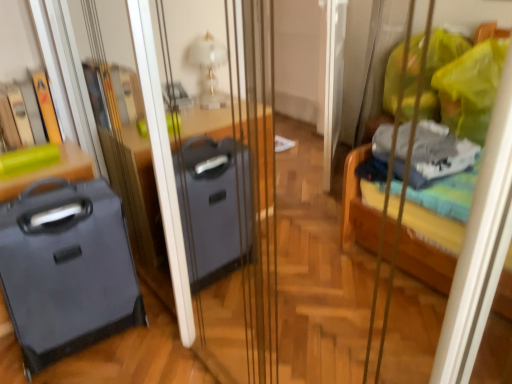
Question: Choose the correct answer: Is matte black suitcase at left inside green matte suitcase at left or outside it?

Choices:
 (A) inside
 (B) outside

Answer: (B)

Question: Considering the positions of point tap(120, 243) and point tap(12, 183), is point tap(120, 243) closer or farther from the camera than point tap(12, 183)?

Choices:
 (A) farther
 (B) closer

Answer: (A)

Question: From the image's perspective, is matte black suitcase at left positioned above or below green matte suitcase at left?

Choices:
 (A) below
 (B) above

Answer: (A)

Question: From their relative heights in the image, would you say green matte suitcase at left is taller or shorter than matte black suitcase at left?

Choices:
 (A) tall
 (B) short

Answer: (B)

Question: Based on their positions, is green matte suitcase at left located to the left or right of matte black suitcase at left?

Choices:
 (A) right
 (B) left

Answer: (B)

Question: From a real-world perspective, relative to matte black suitcase at left, is green matte suitcase at left vertically above or below?

Choices:
 (A) below
 (B) above

Answer: (B)

Question: Does point (62, 158) appear closer or farther from the camera than point (96, 337)?

Choices:
 (A) farther
 (B) closer

Answer: (A)